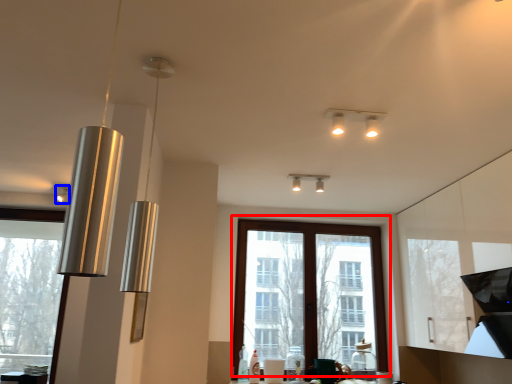
Question: Among these objects, which one is farthest to the camera, window (highlighted by a red box) or lamp (highlighted by a blue box)?

Choices:
 (A) window
 (B) lamp

Answer: (A)